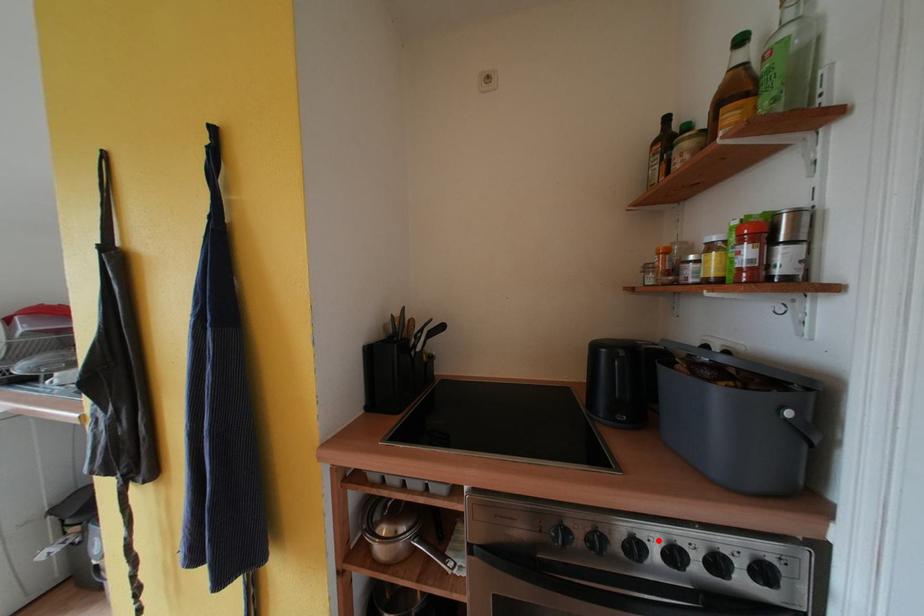
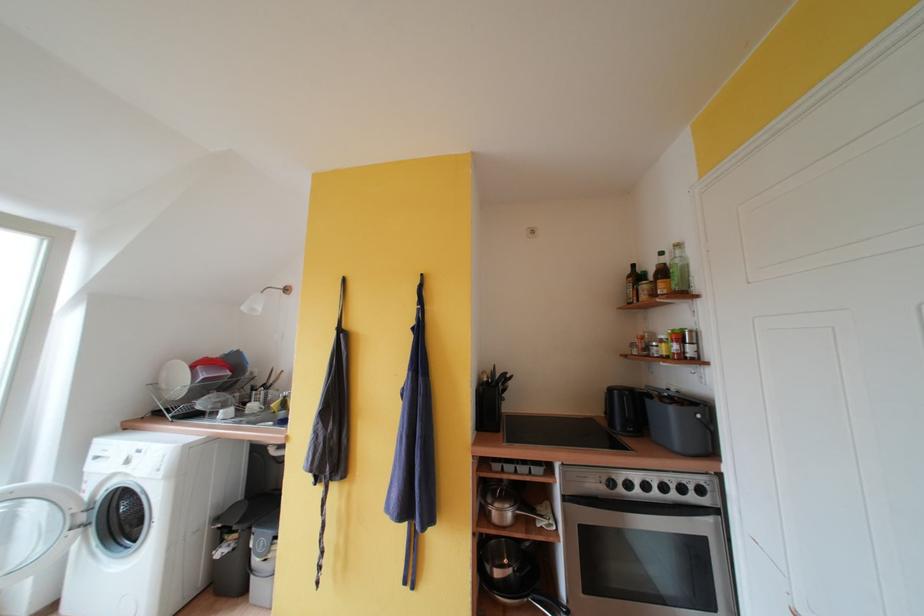
In the second image, find the point that corresponds to the highlighted location in the first image.

(660, 484)